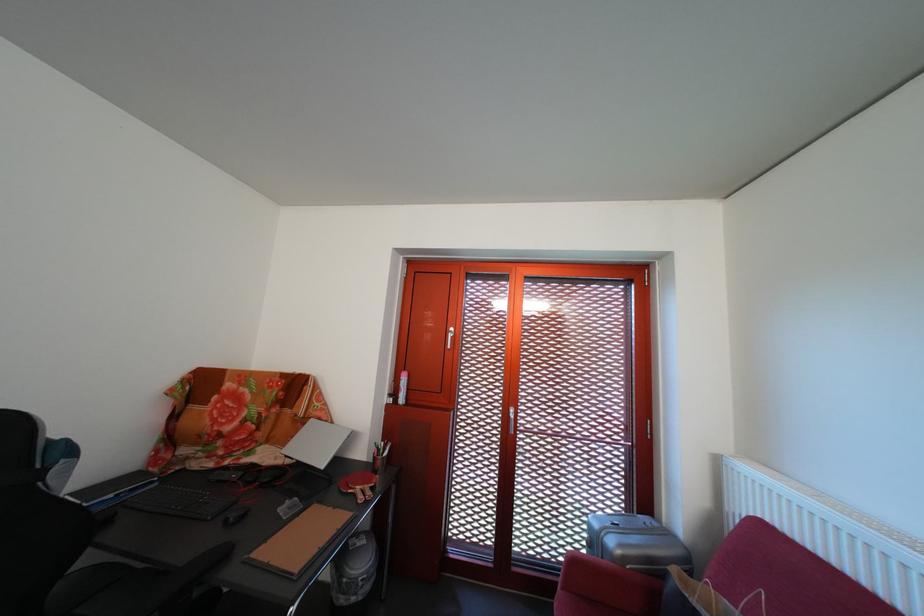
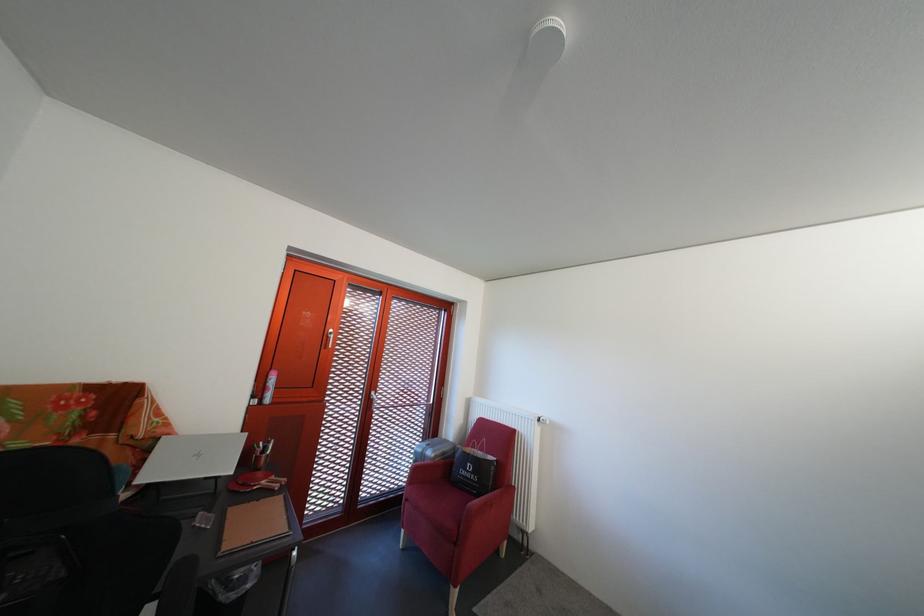
Locate, in the second image, the point that corresponds to (x=400, y=402) in the first image.

(263, 403)